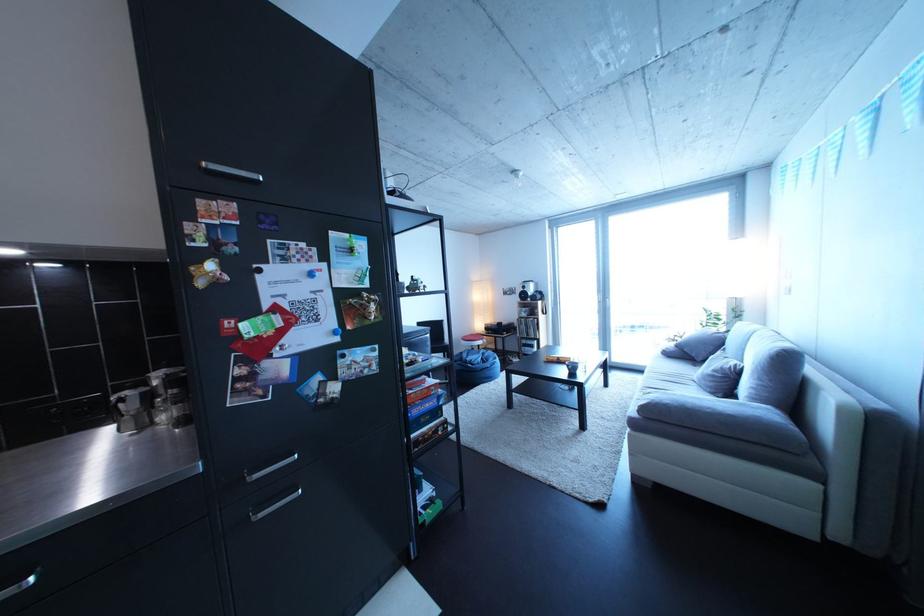
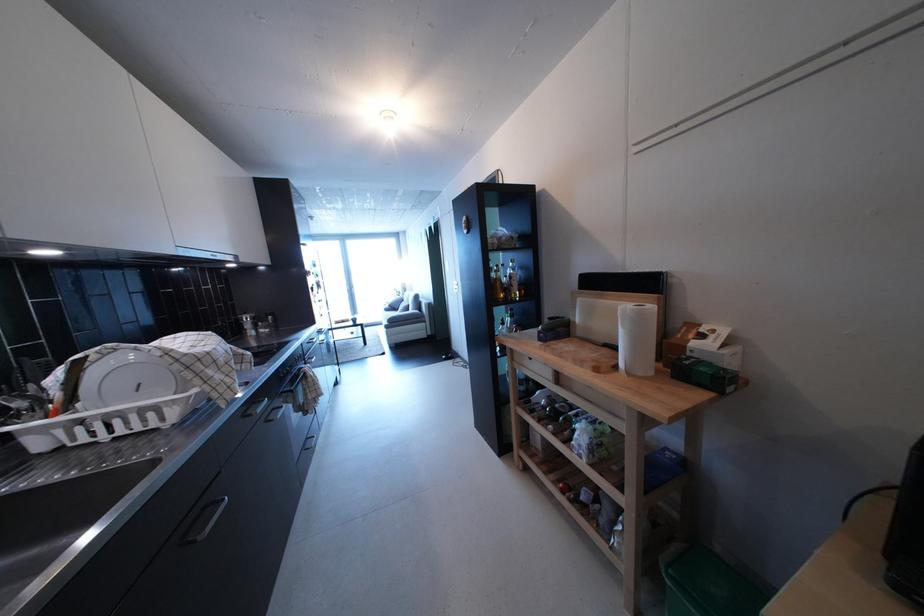
Question: I am providing you with two images of the same scene from different viewpoints. Which of the following objects are not visible in image2?

Choices:
 (A) pink bag zipper
 (B) small white box
 (C) sofa armrest
 (D) silver cabinet handle

Answer: (D)